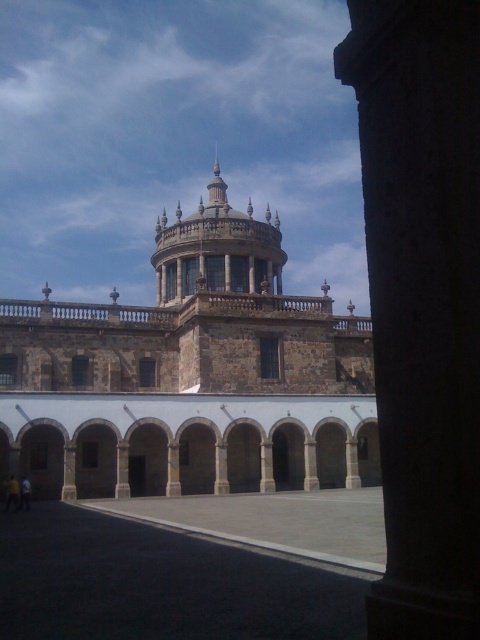
Question: Can you confirm if stone dome at center is positioned to the left of brown stone tower at center?

Choices:
 (A) no
 (B) yes

Answer: (A)

Question: Does stone dome at center have a greater width compared to brown stone tower at center?

Choices:
 (A) no
 (B) yes

Answer: (B)

Question: Which object appears closest to the camera in this image?

Choices:
 (A) stone dome at center
 (B) brown stone tower at center

Answer: (A)

Question: Can you confirm if stone dome at center is positioned above brown stone tower at center?

Choices:
 (A) yes
 (B) no

Answer: (B)